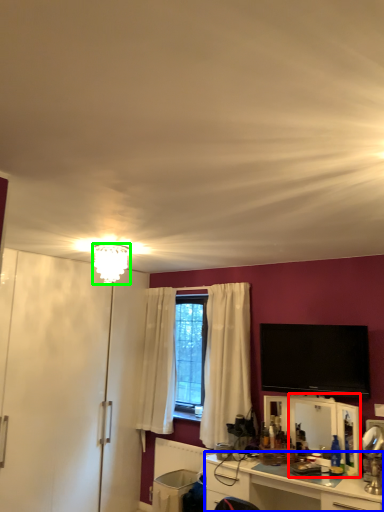
Question: Which is nearer to the mirror (highlighted by a red box)? cabinetry (highlighted by a blue box) or lamp (highlighted by a green box).

Choices:
 (A) cabinetry
 (B) lamp

Answer: (A)